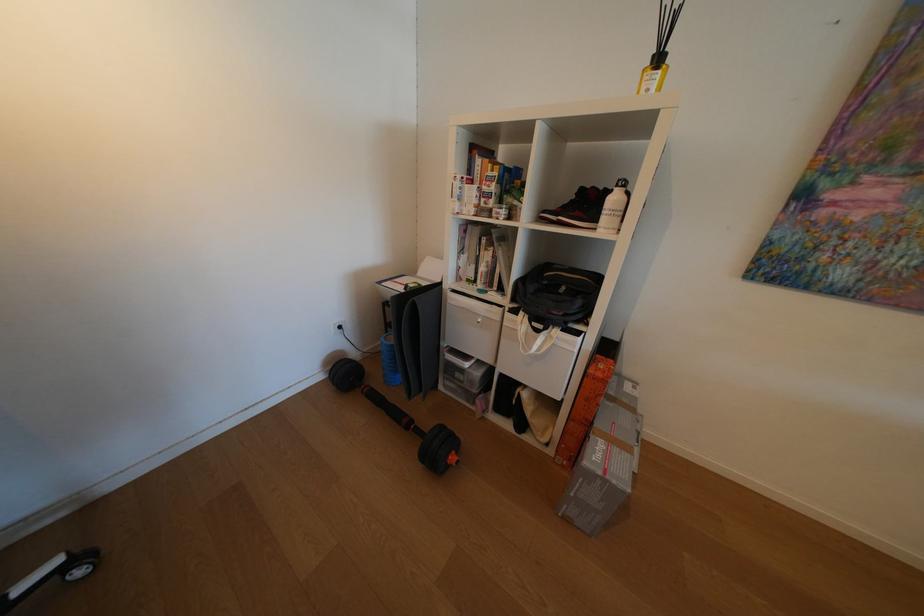
You are a GUI agent. You are given a task and a screenshot of the screen. Output one action in this format:
    pyautogui.click(x=<x>, y=<y>)
    Task: Click on the tote bag handle
    
    Given the screenshot: What is the action you would take?
    pyautogui.click(x=533, y=334)